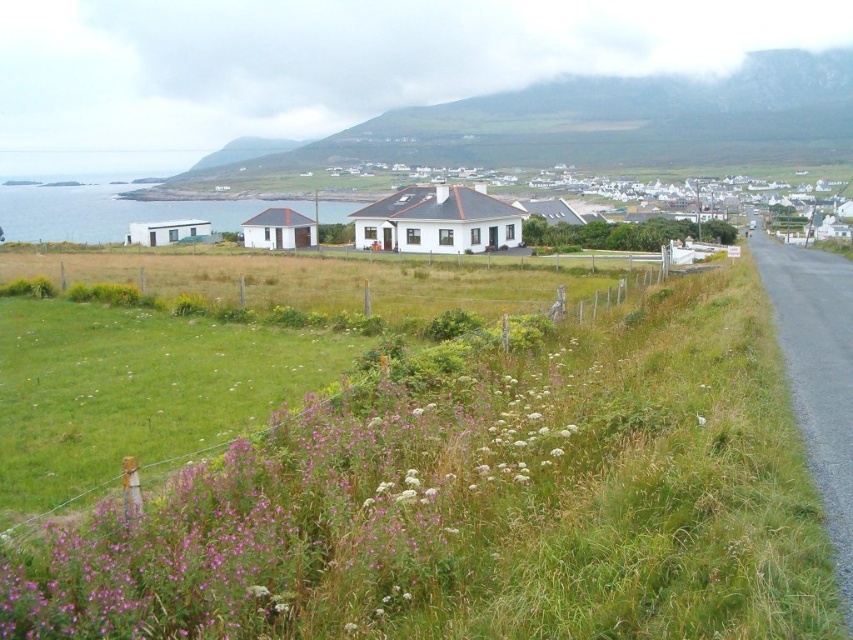
Who is shorter, purple soft grass at lower left or green grassy hillside at upper center?

purple soft grass at lower left

Is purple soft grass at lower left to the right of green grassy hillside at upper center from the viewer's perspective?

Incorrect, purple soft grass at lower left is not on the right side of green grassy hillside at upper center.

Image resolution: width=853 pixels, height=640 pixels. In order to click on purple soft grass at lower left in this screenshot , I will do 309,516.

You are a GUI agent. You are given a task and a screenshot of the screen. Output one action in this format:
    pyautogui.click(x=<x>, y=<y>)
    Task: Click on the purple soft grass at lower left
    
    Given the screenshot: What is the action you would take?
    pyautogui.click(x=309, y=516)

Is purple soft grass at lower left taller than white matte house at center?

Incorrect, purple soft grass at lower left's height is not larger of white matte house at center's.

The image size is (853, 640). I want to click on purple soft grass at lower left, so click(309, 516).

Where is `purple soft grass at lower left`? This screenshot has width=853, height=640. purple soft grass at lower left is located at coordinates (309, 516).

Does green grassy hillside at upper center have a greater height compared to white matte house at center?

Yes, green grassy hillside at upper center is taller than white matte house at center.

The height and width of the screenshot is (640, 853). Identify the location of green grassy hillside at upper center. (583, 125).

The height and width of the screenshot is (640, 853). I want to click on green grassy hillside at upper center, so click(583, 125).